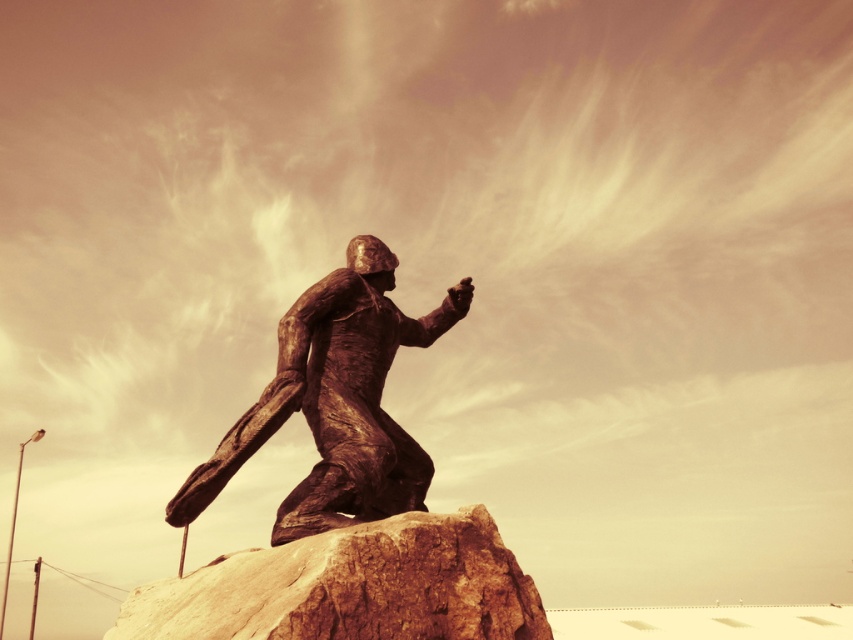
Question: Is rusty stone boulder at center positioned in front of bronze statue at center?

Choices:
 (A) yes
 (B) no

Answer: (A)

Question: Which object appears farthest from the camera in this image?

Choices:
 (A) rusty stone boulder at center
 (B) bronze statue at center

Answer: (B)

Question: Which of the following is the farthest from the observer?

Choices:
 (A) 447,300
 (B) 392,598

Answer: (A)

Question: Is rusty stone boulder at center above bronze statue at center?

Choices:
 (A) no
 (B) yes

Answer: (A)

Question: Can you confirm if rusty stone boulder at center is positioned to the right of bronze statue at center?

Choices:
 (A) yes
 (B) no

Answer: (B)